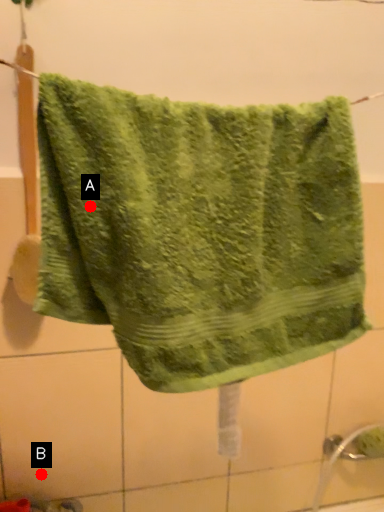
Question: Two points are circled on the image, labeled by A and B beside each circle. Which point is closer to the camera?

Choices:
 (A) A is closer
 (B) B is closer

Answer: (A)